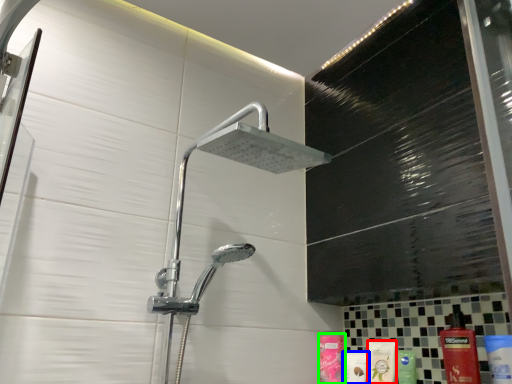
Question: Which object is positioned closest to mouthwash (highlighted by a red box)? Select from toiletry (highlighted by a blue box) and toiletry (highlighted by a green box).

Choices:
 (A) toiletry
 (B) toiletry

Answer: (A)